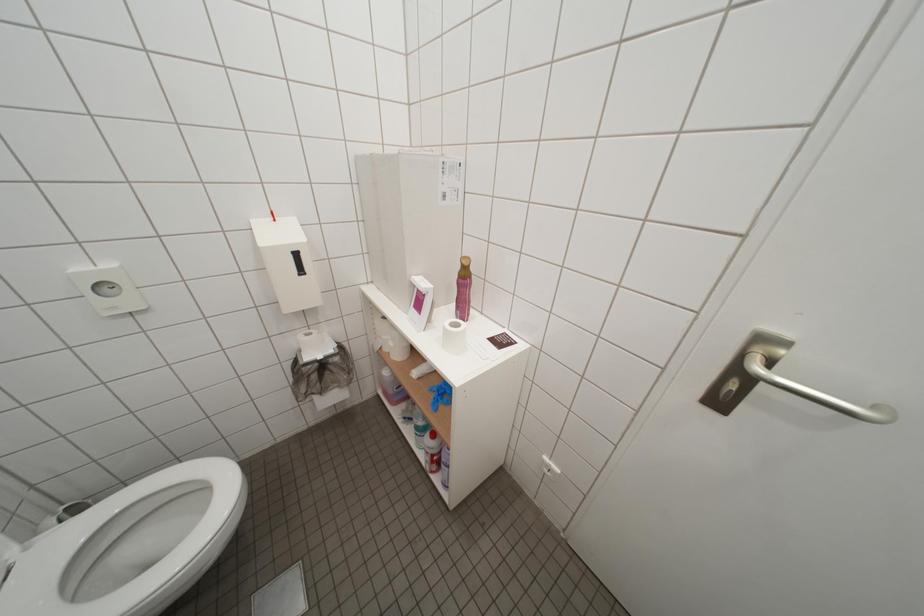
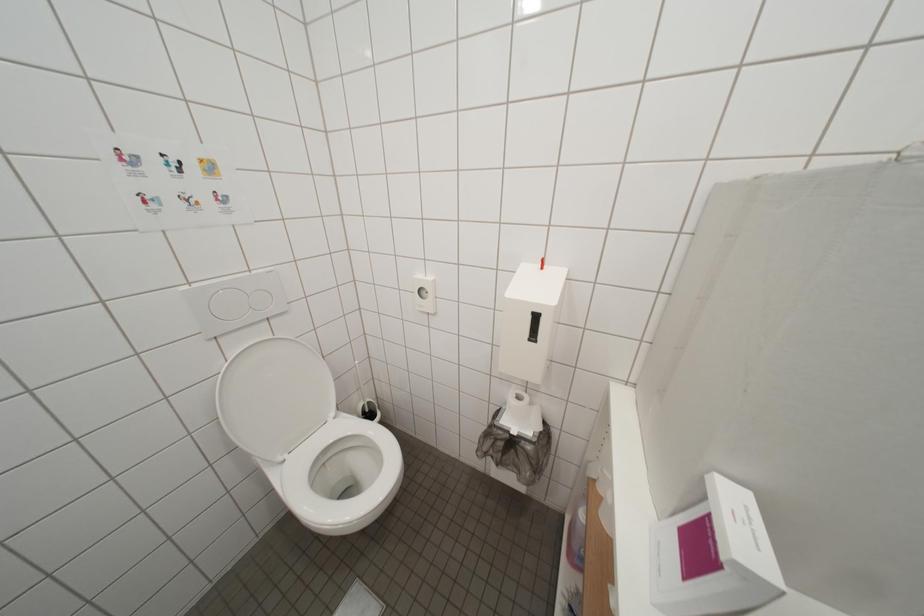
Question: The camera is either moving clockwise (left) or counter-clockwise (right) around the object. The first image is from the beginning of the video and the second image is from the end. Is the camera moving left or right when shooting the video?

Choices:
 (A) Left
 (B) Right

Answer: (B)